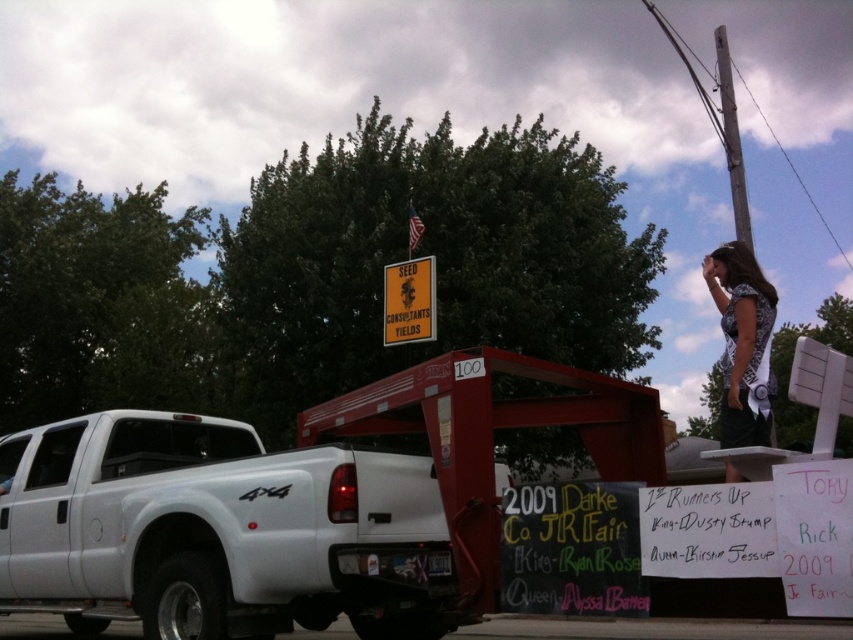
Question: Which of the following is the closest to the observer?

Choices:
 (A) white matte truck at lower left
 (B) gray wooden pole at upper right

Answer: (A)

Question: Which of the following is the farthest from the observer?

Choices:
 (A) (38, 577)
 (B) (720, 60)

Answer: (B)

Question: Is white matte truck at lower left in front of yellow paper sign at center?

Choices:
 (A) no
 (B) yes

Answer: (B)

Question: Is white matte truck at lower left to the left of gray wooden pole at upper right from the viewer's perspective?

Choices:
 (A) yes
 (B) no

Answer: (A)

Question: Does white matte truck at lower left have a greater width compared to gray wooden pole at upper right?

Choices:
 (A) no
 (B) yes

Answer: (A)

Question: Which point is farther to the camera?

Choices:
 (A) yellow paper sign at center
 (B) gray wooden pole at upper right

Answer: (A)